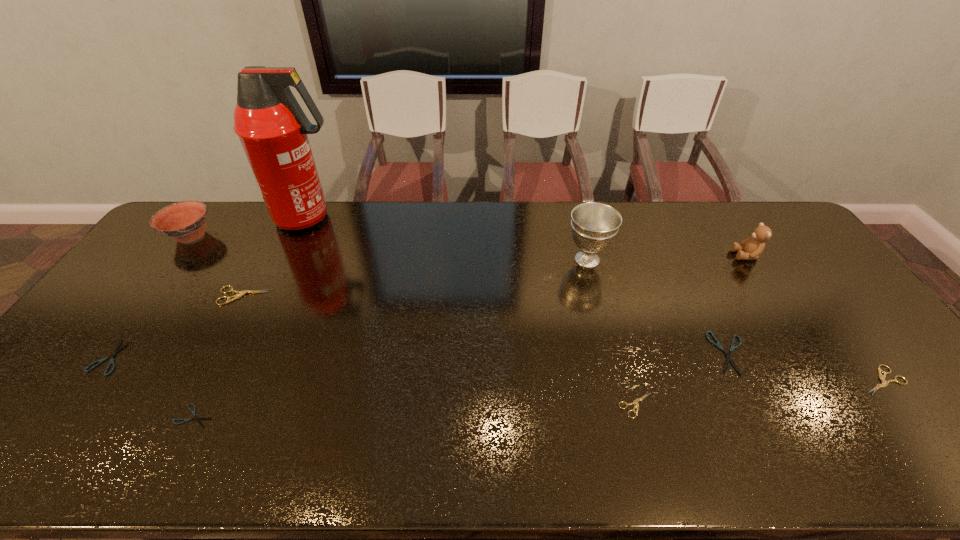
I want to click on red fire extinguisher, so (x=272, y=127).

Where is `fire extinguisher`? The width and height of the screenshot is (960, 540). fire extinguisher is located at coordinates (272, 127).

Where is `the ninth shortest object`? the ninth shortest object is located at coordinates (594, 225).

This screenshot has height=540, width=960. Identify the location of teddy bear. tap(752, 247).

Image resolution: width=960 pixels, height=540 pixels. Identify the location of the third tallest object. (752, 247).

Identify the location of bowl. (185, 221).

Where is `the farthest shears`? the farthest shears is located at coordinates (241, 293).

Locate an element on the screen. the biggest beige shears is located at coordinates (241, 293).

Where is `the sixth tallest object`? This screenshot has width=960, height=540. the sixth tallest object is located at coordinates (884, 383).

Locate an element on the screen. the rightmost shears is located at coordinates (884, 383).